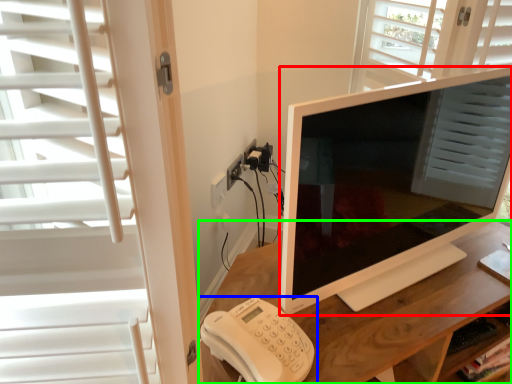
Question: Based on their relative distances, which object is farther from television (highlighted by a red box)? Choose from corded phone (highlighted by a blue box) and desk (highlighted by a green box).

Choices:
 (A) corded phone
 (B) desk

Answer: (A)